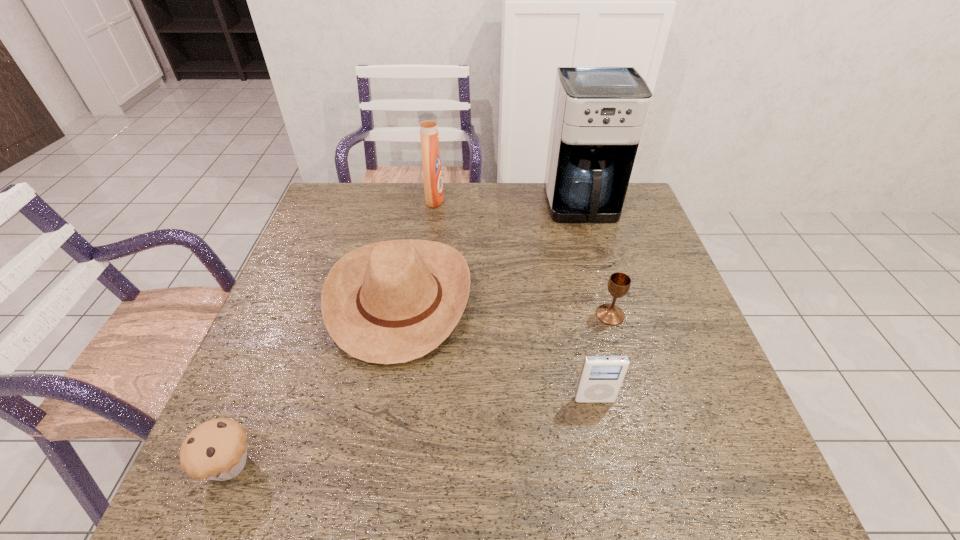
The image size is (960, 540). What are the coordinates of `free space between the cowboy hat and the nearest object` in the screenshot? It's located at (315, 381).

Identify the location of free spot between the fifth farthest object and the detergent. (515, 299).

Locate an element on the screen. Image resolution: width=960 pixels, height=540 pixels. unoccupied position between the iPod and the tallest object is located at coordinates (588, 304).

Where is `object that can be found as the second closest to the shortest object`? The width and height of the screenshot is (960, 540). object that can be found as the second closest to the shortest object is located at coordinates (601, 377).

Locate an element on the screen. The height and width of the screenshot is (540, 960). object that is the closest to the tallest object is located at coordinates (389, 302).

Identify the location of free spot that satisfies the following two spatial constraints: 1. on the front-facing side of the second tallest object; 2. on the front side of the nearest object. (400, 464).

Identify the location of vacant point that satisfies the following two spatial constraints: 1. on the front-facing side of the second tallest object; 2. on the back side of the chalice. Image resolution: width=960 pixels, height=540 pixels. (420, 315).

Locate an element on the screen. The width and height of the screenshot is (960, 540). free space that satisfies the following two spatial constraints: 1. on the back side of the chalice; 2. on the front-facing side of the cowboy hat is located at coordinates (606, 299).

What are the coordinates of `free space that satisfies the following two spatial constraints: 1. on the front-facing side of the cowboy hat; 2. on the left side of the second shortest object` in the screenshot? It's located at (397, 315).

In order to click on vacant space that satisfies the following two spatial constraints: 1. on the front-facing side of the fifth tallest object; 2. on the left side of the cowboy hat in this screenshot , I will do `click(397, 315)`.